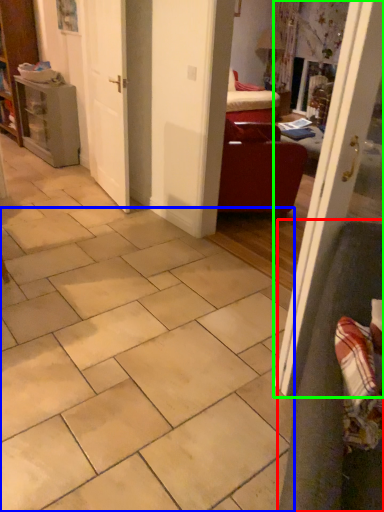
Question: Considering the real-world distances, which object is farthest from armchair (highlighted by a red box)? ceramic tile (highlighted by a blue box) or door (highlighted by a green box)?

Choices:
 (A) ceramic tile
 (B) door

Answer: (A)